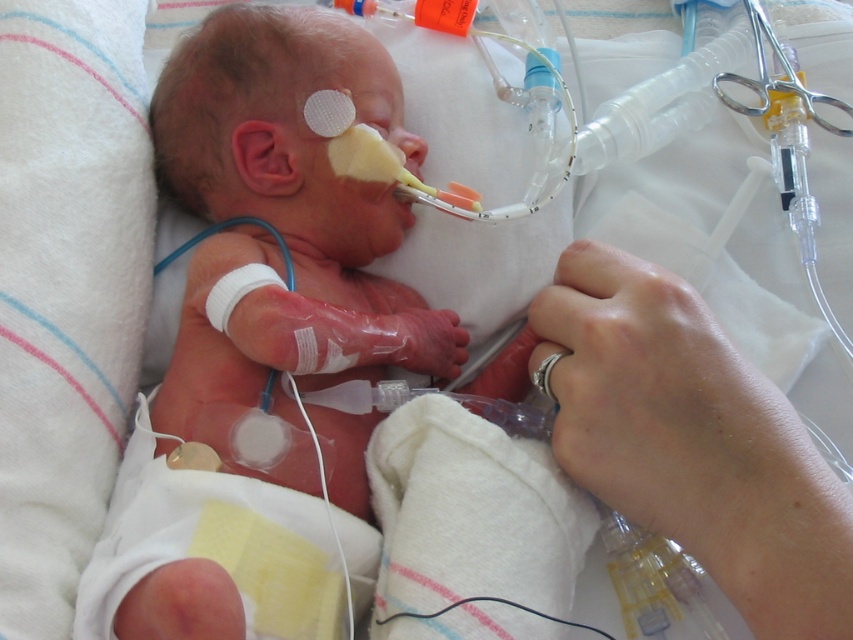
In the scene shown: Which is above, clear plastic tube at lower right or silver metallic teething ring at lower center?

silver metallic teething ring at lower center is higher up.

Between clear plastic tube at lower right and silver metallic teething ring at lower center, which one has less height?

silver metallic teething ring at lower center is shorter.

You are a GUI agent. You are given a task and a screenshot of the screen. Output one action in this format:
    pyautogui.click(x=<x>, y=<y>)
    Task: Click on the clear plastic tube at lower right
    
    Given the screenshot: What is the action you would take?
    pyautogui.click(x=693, y=442)

Locate an element on the screen. The height and width of the screenshot is (640, 853). clear plastic tube at lower right is located at coordinates (693, 442).